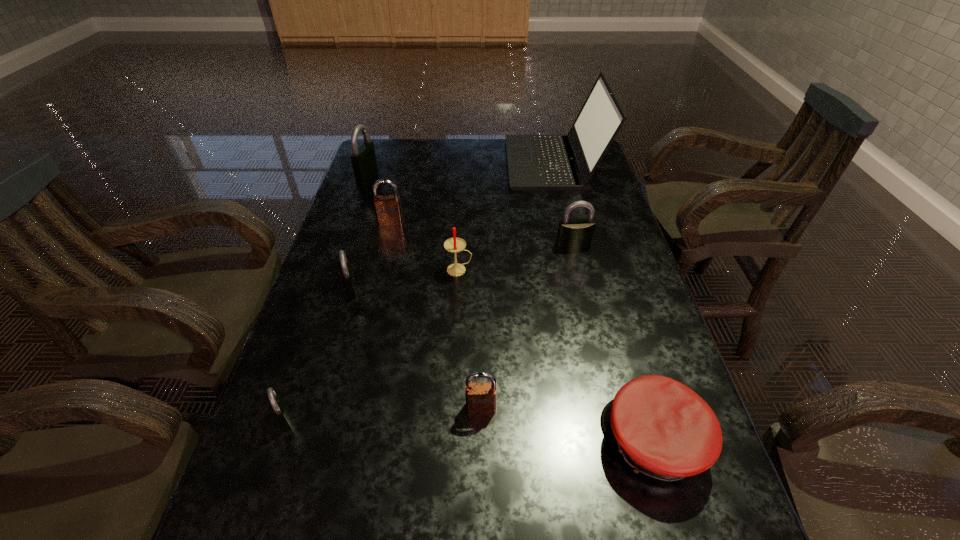
The height and width of the screenshot is (540, 960). Identify the location of laptop. click(x=535, y=162).

Where is `gray laptop`? This screenshot has width=960, height=540. gray laptop is located at coordinates (535, 162).

What are the coordinates of `the eighth shortest object` in the screenshot? It's located at (364, 162).

This screenshot has width=960, height=540. In order to click on the farthest black padlock in this screenshot , I will do `click(364, 162)`.

Find the location of `the sixth nearest object`. the sixth nearest object is located at coordinates (573, 234).

Where is `the rightmost black padlock`? Image resolution: width=960 pixels, height=540 pixels. the rightmost black padlock is located at coordinates (573, 234).

Identify the location of the farther brown padlock. This screenshot has width=960, height=540. (388, 210).

The width and height of the screenshot is (960, 540). Find the location of `the bigger brown padlock`. the bigger brown padlock is located at coordinates (388, 210).

Identify the location of candle. (454, 244).

The height and width of the screenshot is (540, 960). Identify the location of the third biggest black padlock. (346, 271).